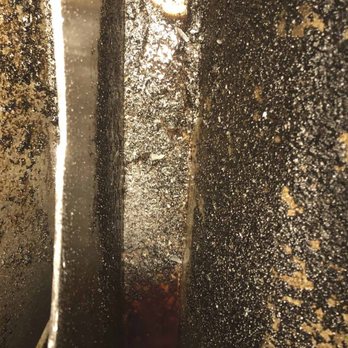
You are a GUI agent. You are given a task and a screenshot of the screen. Output one action in this format:
    pyautogui.click(x=<x>, y=<y>)
    Task: Click on the right wall
    This screenshot has height=348, width=348.
    Given the screenshot: What is the action you would take?
    pyautogui.click(x=216, y=167)